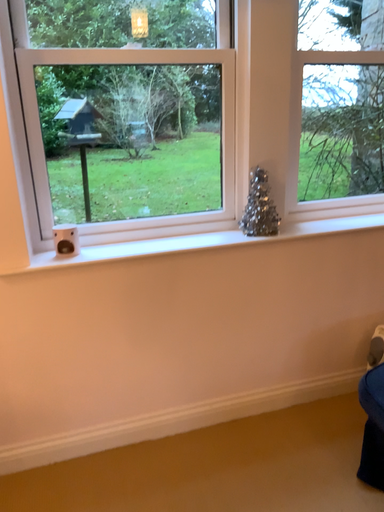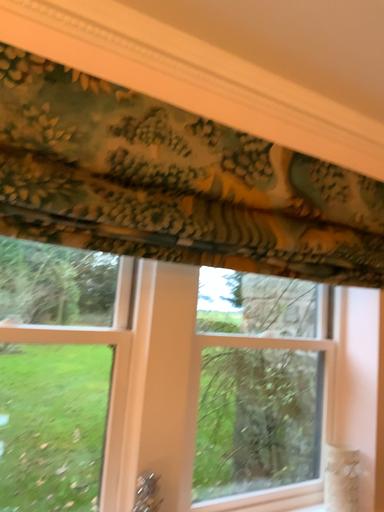
Question: How did the camera likely rotate when shooting the video?

Choices:
 (A) rotated upward
 (B) rotated downward

Answer: (A)